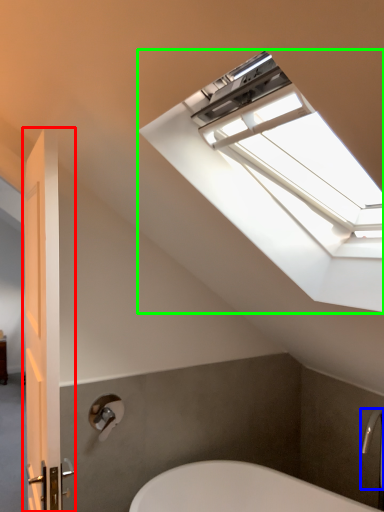
Question: Which is nearer to the door (highlighted by a red box)? faucet (highlighted by a blue box) or window (highlighted by a green box).

Choices:
 (A) faucet
 (B) window

Answer: (B)